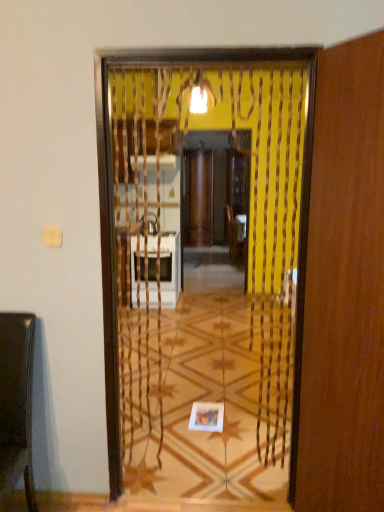
Question: Should I look upward or downward to see wooden screen door at right, which is the 1th screen door from front to back?

Choices:
 (A) down
 (B) up

Answer: (A)

Question: Is wooden screen door at center, the 2th screen door when ordered from front to back, far from shiny brown chair at left?

Choices:
 (A) no
 (B) yes

Answer: (B)

Question: Would you say wooden screen door at center, the 2th screen door when ordered from front to back, is outside shiny brown chair at left?

Choices:
 (A) yes
 (B) no

Answer: (A)

Question: From a real-world perspective, is wooden screen door at center, acting as the 1th screen door starting from the back, located higher than shiny brown chair at left?

Choices:
 (A) no
 (B) yes

Answer: (B)

Question: From the image's perspective, is wooden screen door at center, the 2th screen door when ordered from front to back, on top of shiny brown chair at left?

Choices:
 (A) yes
 (B) no

Answer: (A)

Question: Does wooden screen door at center, acting as the 1th screen door starting from the back, have a greater width compared to shiny brown chair at left?

Choices:
 (A) no
 (B) yes

Answer: (A)

Question: Considering the relative sizes of wooden screen door at center, the 2th screen door when ordered from front to back, and shiny brown chair at left in the image provided, is wooden screen door at center, the 2th screen door when ordered from front to back, taller than shiny brown chair at left?

Choices:
 (A) no
 (B) yes

Answer: (B)

Question: Would you say wooden screen door at right, which is the 1th screen door from front to back, is part of shiny brown chair at left's contents?

Choices:
 (A) yes
 (B) no

Answer: (B)

Question: Is shiny brown chair at left at the right side of wooden screen door at right, which is the 1th screen door from front to back?

Choices:
 (A) no
 (B) yes

Answer: (A)

Question: Is shiny brown chair at left oriented towards wooden screen door at right, which is the 1th screen door from front to back?

Choices:
 (A) yes
 (B) no

Answer: (B)

Question: Is shiny brown chair at left directly adjacent to wooden screen door at right, positioned as the second screen door in back-to-front order?

Choices:
 (A) no
 (B) yes

Answer: (A)

Question: Considering the relative positions of shiny brown chair at left and wooden screen door at right, which is the 1th screen door from front to back, in the image provided, is shiny brown chair at left to the left of wooden screen door at right, which is the 1th screen door from front to back, from the viewer's perspective?

Choices:
 (A) yes
 (B) no

Answer: (A)

Question: Considering the relative sizes of shiny brown chair at left and wooden screen door at right, which is the 1th screen door from front to back, in the image provided, is shiny brown chair at left smaller than wooden screen door at right, which is the 1th screen door from front to back,?

Choices:
 (A) yes
 (B) no

Answer: (A)

Question: Is shiny brown chair at left touching wooden screen door at center, the 2th screen door when ordered from front to back?

Choices:
 (A) no
 (B) yes

Answer: (A)